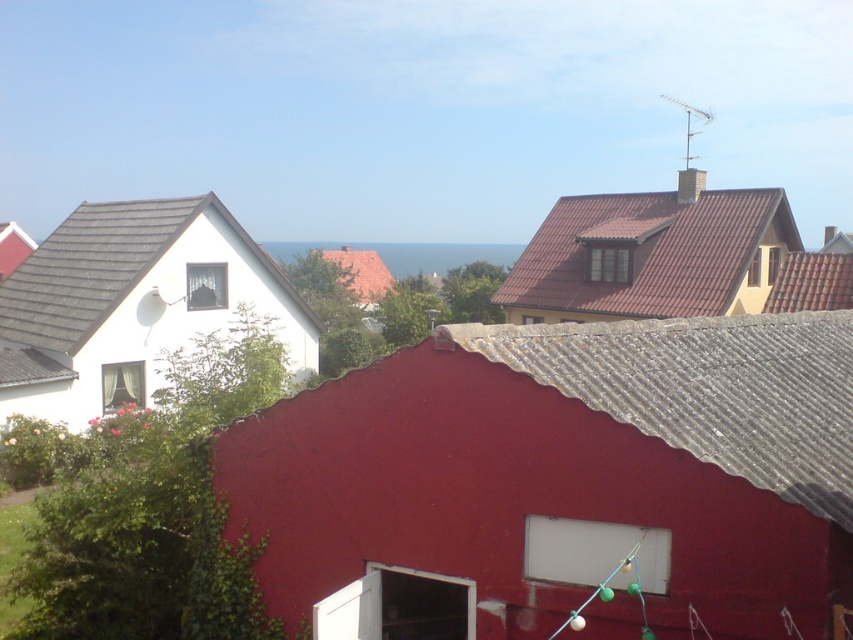
You are a drone operator tasked with capturing aerial footage of a neighborhood. You need to determine which of the two roofs, the brown tile roof at upper right or the red tile roof at center, will require less camera panning to fully capture in a single shot. Which roof would that be?

The brown tile roof at upper right occupies less space than the red tile roof at center, so it will require less camera panning to fully capture in a single shot.